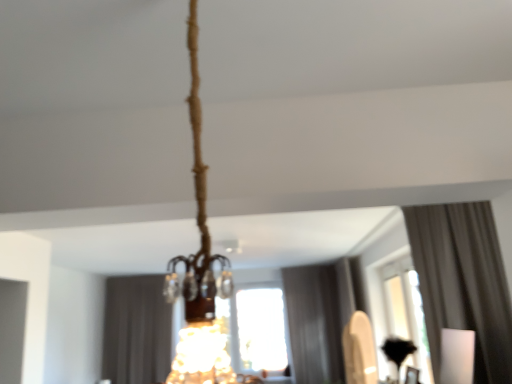
Question: Does transparent glass window at center turn towards white fabric curtain at upper right, which is counted as the third curtain, starting from the left?

Choices:
 (A) yes
 (B) no

Answer: (B)

Question: Is transparent glass window at center behind white fabric curtain at upper right, which is counted as the third curtain, starting from the left?

Choices:
 (A) no
 (B) yes

Answer: (B)

Question: From the image's perspective, is transparent glass window at center under white fabric curtain at upper right, which is the third curtain from back to front?

Choices:
 (A) no
 (B) yes

Answer: (B)

Question: Is transparent glass window at center smaller than white fabric curtain at upper right, the first curtain from the right?

Choices:
 (A) yes
 (B) no

Answer: (A)

Question: Considering the relative sizes of transparent glass window at center and white fabric curtain at upper right, which is the third curtain from back to front, in the image provided, is transparent glass window at center thinner than white fabric curtain at upper right, which is the third curtain from back to front,?

Choices:
 (A) yes
 (B) no

Answer: (A)

Question: Would you say white fabric curtain at upper right, which is counted as the third curtain, starting from the left, is inside or outside transparent glass window at center?

Choices:
 (A) inside
 (B) outside

Answer: (B)

Question: Relative to transparent glass window at center, is white fabric curtain at upper right, which is the third curtain from back to front, in front or behind?

Choices:
 (A) behind
 (B) front

Answer: (B)

Question: Looking at the image, does white fabric curtain at upper right, which is counted as the third curtain, starting from the left, seem bigger or smaller compared to transparent glass window at center?

Choices:
 (A) big
 (B) small

Answer: (A)

Question: From a real-world perspective, relative to transparent glass window at center, is white fabric curtain at upper right, which is counted as the third curtain, starting from the left, vertically above or below?

Choices:
 (A) below
 (B) above

Answer: (B)

Question: Is gray fabric curtain at center, which is counted as the second curtain, starting from the left, taller or shorter than transparent glass window at center?

Choices:
 (A) tall
 (B) short

Answer: (A)

Question: In the image, is gray fabric curtain at center, marked as the second curtain in a front-to-back arrangement, positioned in front of or behind transparent glass window at center?

Choices:
 (A) front
 (B) behind

Answer: (B)

Question: Which is correct: gray fabric curtain at center, which is counted as the second curtain, starting from the left, is inside transparent glass window at center, or outside of it?

Choices:
 (A) outside
 (B) inside

Answer: (A)

Question: In the image, is gray fabric curtain at center, acting as the 2th curtain starting from the right, on the left side or the right side of transparent glass window at center?

Choices:
 (A) left
 (B) right

Answer: (A)

Question: From a real-world perspective, is dark gray fabric curtain at center, arranged as the 3th curtain when viewed from the front, positioned above or below transparent glass window at center?

Choices:
 (A) above
 (B) below

Answer: (A)

Question: Is point (138, 307) closer or farther from the camera than point (418, 296)?

Choices:
 (A) farther
 (B) closer

Answer: (A)